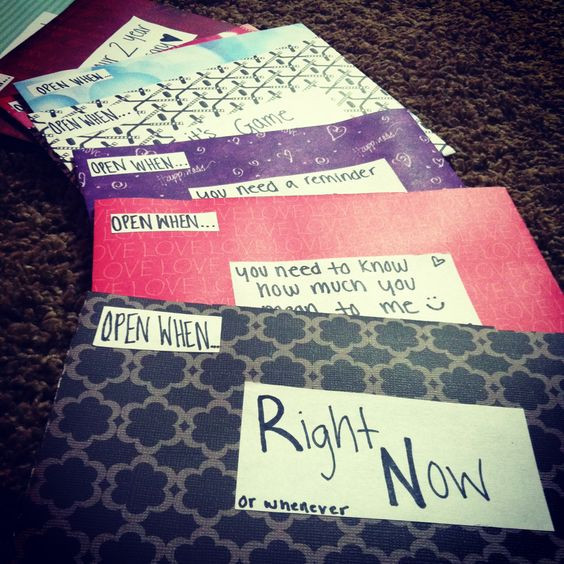
This screenshot has width=564, height=564. Identify the location of carpet. (480, 59).